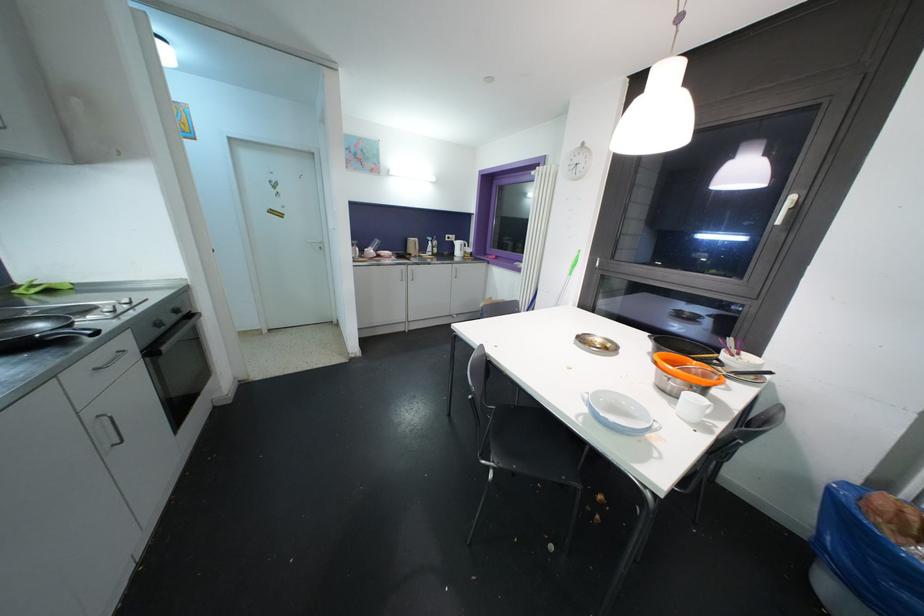
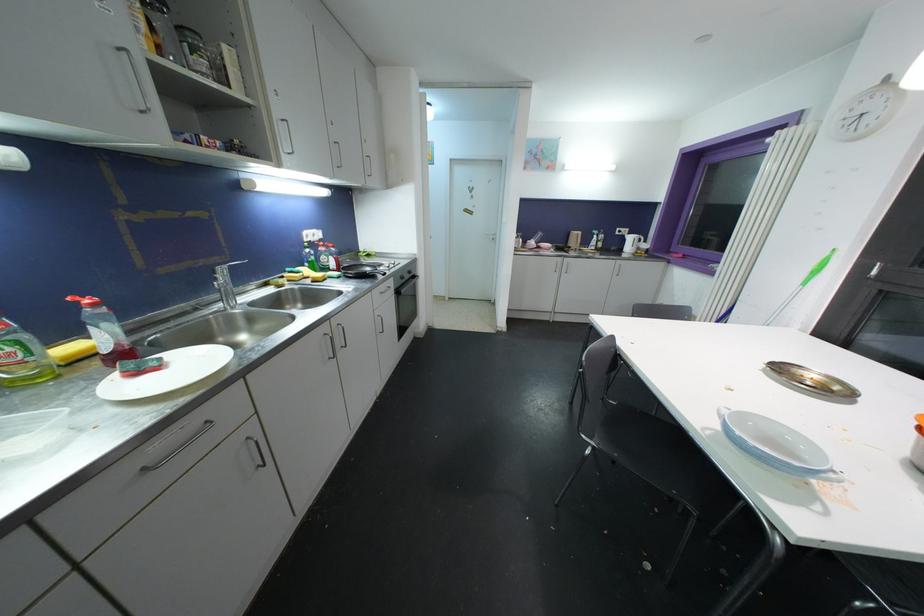
The point at (43, 329) is marked in the first image. Where is the corresponding point in the second image?

(371, 272)